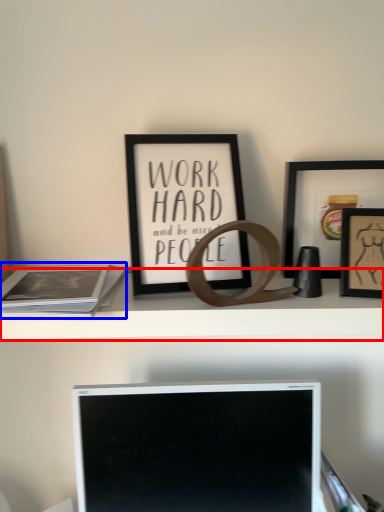
Question: Among these objects, which one is nearest to the camera, shelf (highlighted by a red box) or paperback book (highlighted by a blue box)?

Choices:
 (A) shelf
 (B) paperback book

Answer: (B)